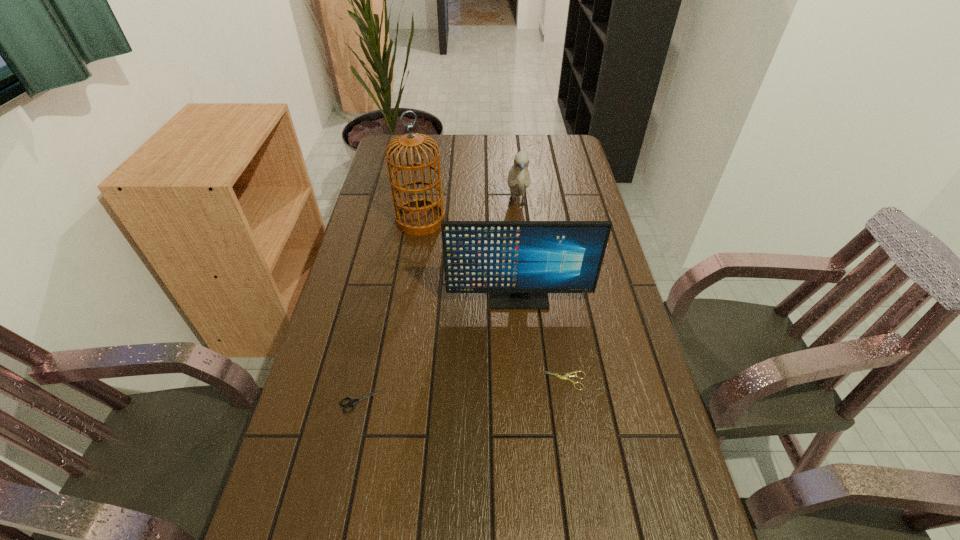
The width and height of the screenshot is (960, 540). In the image, there is a desktop. What are the coordinates of `vacant space at the far right corner` in the screenshot? It's located at (552, 157).

This screenshot has height=540, width=960. Identify the location of blank region between the taller shears and the computer monitor. (441, 349).

Find the location of a particular element. vacant region between the computer monitor and the right shears is located at coordinates (541, 340).

The height and width of the screenshot is (540, 960). Find the location of `empty location between the taller shears and the birdcage`. empty location between the taller shears and the birdcage is located at coordinates (392, 310).

At what (x,y) coordinates should I click in order to perform the action: click on vacant area that lies between the shorter shears and the taller shears. Please return your answer as a coordinate pair (x, y). Image resolution: width=960 pixels, height=540 pixels. Looking at the image, I should click on (464, 390).

Where is `object that is the closest to the third shortest object`? object that is the closest to the third shortest object is located at coordinates (421, 216).

Identify which object is the fourth nearest to the fourth shortest object. Please provide its 2D coordinates. Your answer should be formatted as a tuple, i.e. [(x, y)], where the tuple contains the x and y coordinates of a point satisfying the conditions above.

[(518, 177)]

Locate an element on the screen. The width and height of the screenshot is (960, 540). the second closest shears to the second tallest object is located at coordinates (352, 402).

The image size is (960, 540). Identify the location of blank area in the image that satisfies the following two spatial constraints: 1. on the back side of the tallest object; 2. on the left side of the second shortest object. (400, 220).

The height and width of the screenshot is (540, 960). I want to click on free space that satisfies the following two spatial constraints: 1. on the front side of the shortest object; 2. on the left side of the tallest object, so click(396, 381).